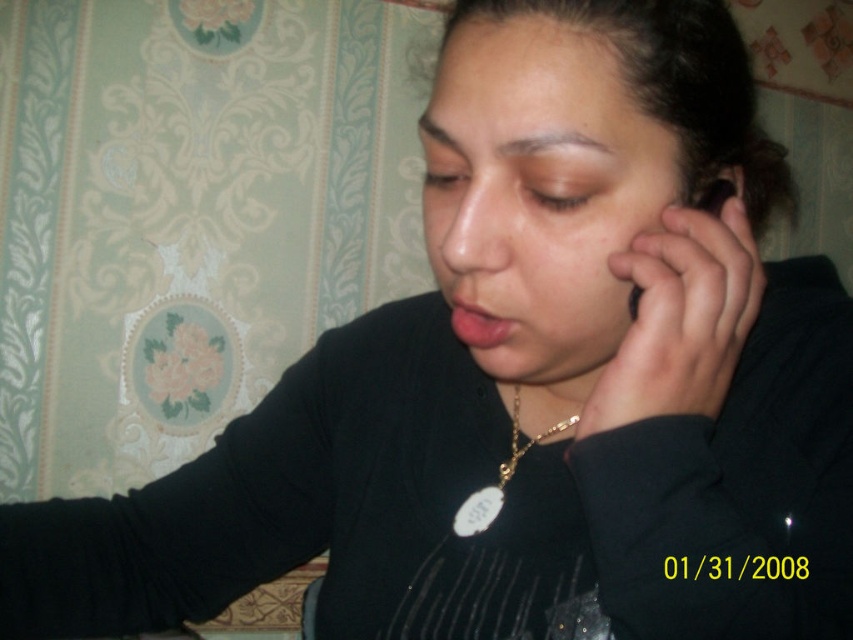
Question: Is smooth skin at right above gold chain at center?

Choices:
 (A) no
 (B) yes

Answer: (B)

Question: Does smooth skin at right appear under gold chain at center?

Choices:
 (A) yes
 (B) no

Answer: (B)

Question: Is matte skin nose at center positioned behind gold chain at center?

Choices:
 (A) no
 (B) yes

Answer: (A)

Question: Which object is closer to the camera taking this photo?

Choices:
 (A) matte skin nose at center
 (B) gold chain at center

Answer: (A)

Question: Which point is closer to the camera taking this photo?

Choices:
 (A) (440, 257)
 (B) (756, 285)

Answer: (A)

Question: Which of the following is the farthest from the observer?

Choices:
 (A) gold chain at center
 (B) smooth skin at right
 (C) matte skin nose at center

Answer: (A)